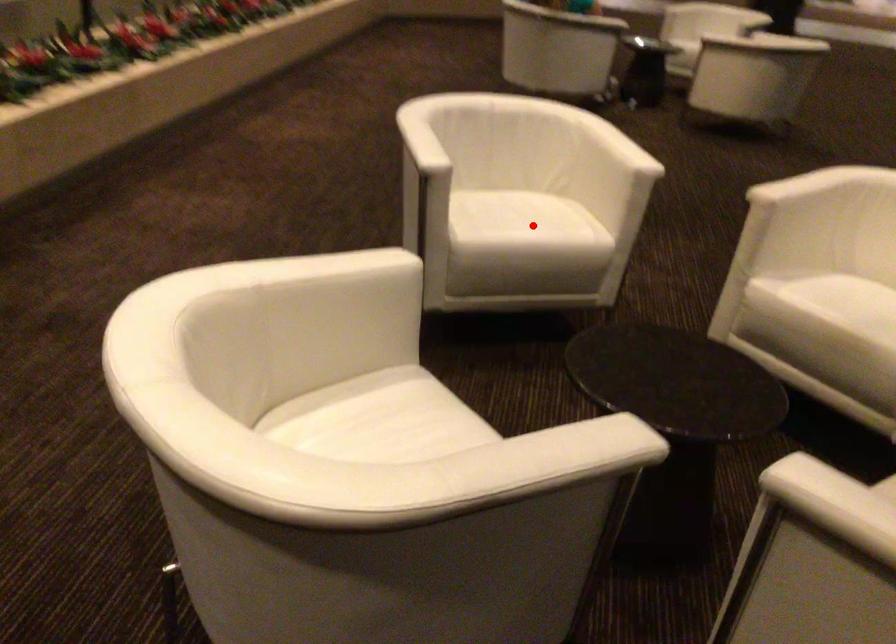
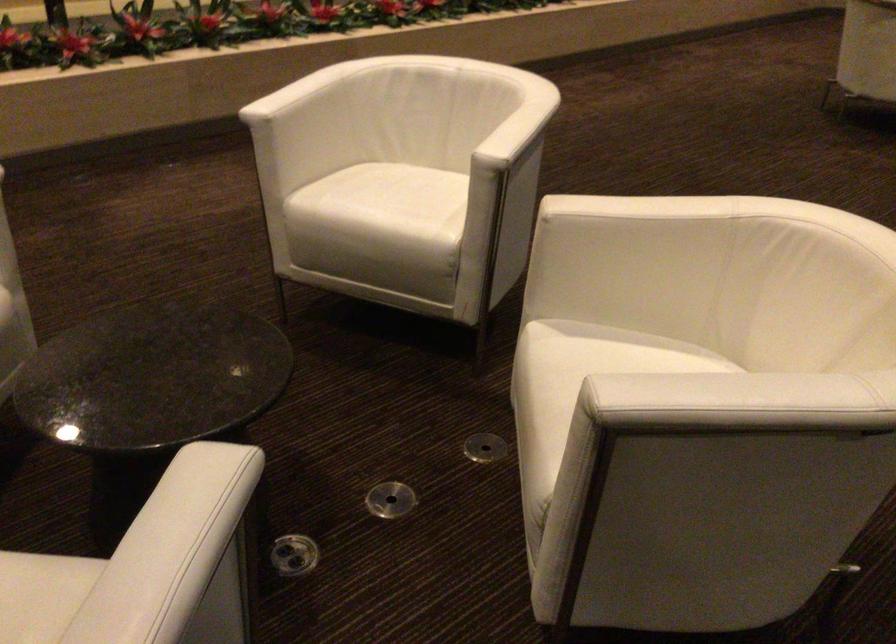
Question: I am providing you with two images of the same scene from different viewpoints. In image1, a red point is highlighted. Considering the same 3D point in image2, which of the following is correct?

Choices:
 (A) It is closer
 (B) It is farther

Answer: (A)